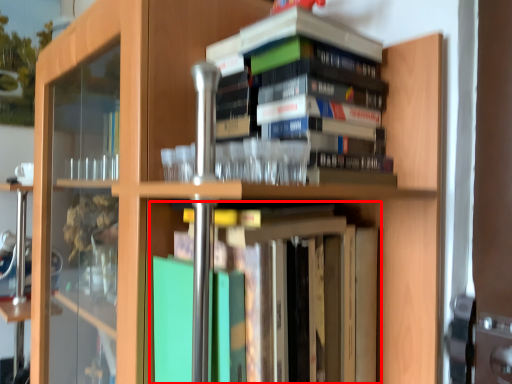
Question: Considering the relative positions of book (annotated by the red box) and book in the image provided, where is book (annotated by the red box) located with respect to the staircase?

Choices:
 (A) right
 (B) left

Answer: (B)